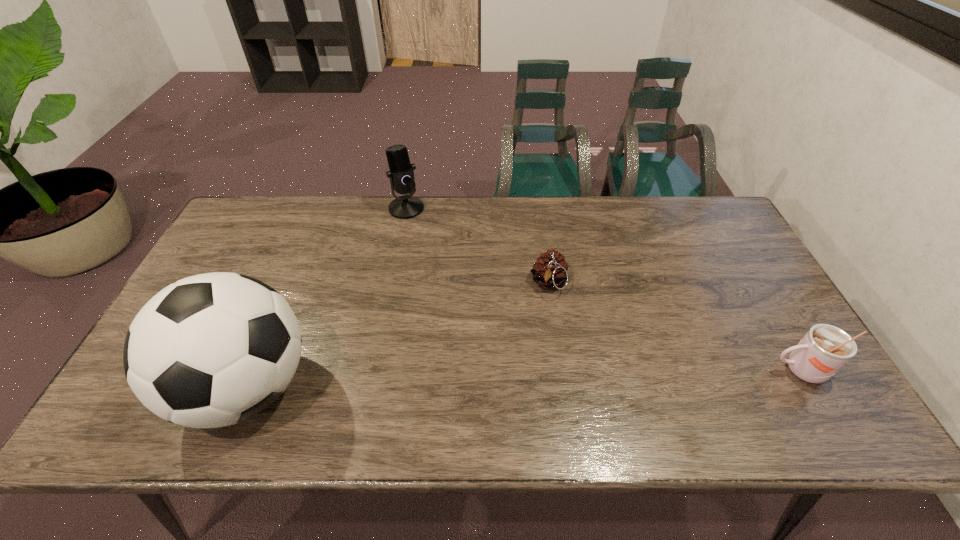
Identify the location of free area in between the tallest object and the second shortest object. (523, 379).

Locate an element on the screen. vacant area that lies between the microphone and the second object from right to left is located at coordinates (477, 246).

Find the location of `free spot between the tallest object and the third tallest object`. free spot between the tallest object and the third tallest object is located at coordinates (523, 379).

Locate an element on the screen. free area in between the microphone and the tallest object is located at coordinates (327, 298).

This screenshot has height=540, width=960. Find the location of `vacant area between the leftmost object and the third tallest object`. vacant area between the leftmost object and the third tallest object is located at coordinates (523, 379).

I want to click on free space between the third object from left to right and the farthest object, so click(477, 246).

Image resolution: width=960 pixels, height=540 pixels. Identify the location of unoccupied position between the third object from left to right and the second tallest object. (477, 246).

You are a GUI agent. You are given a task and a screenshot of the screen. Output one action in this format:
    pyautogui.click(x=<x>, y=<y>)
    Task: Click on the free space between the second object from left to right and the leftmost object
    This screenshot has height=540, width=960.
    Given the screenshot: What is the action you would take?
    pyautogui.click(x=327, y=298)

The width and height of the screenshot is (960, 540). In order to click on the second closest object relative to the leftmost object in this screenshot , I will do `click(550, 271)`.

Locate an element on the screen. The image size is (960, 540). object identified as the second closest to the cup is located at coordinates (401, 174).